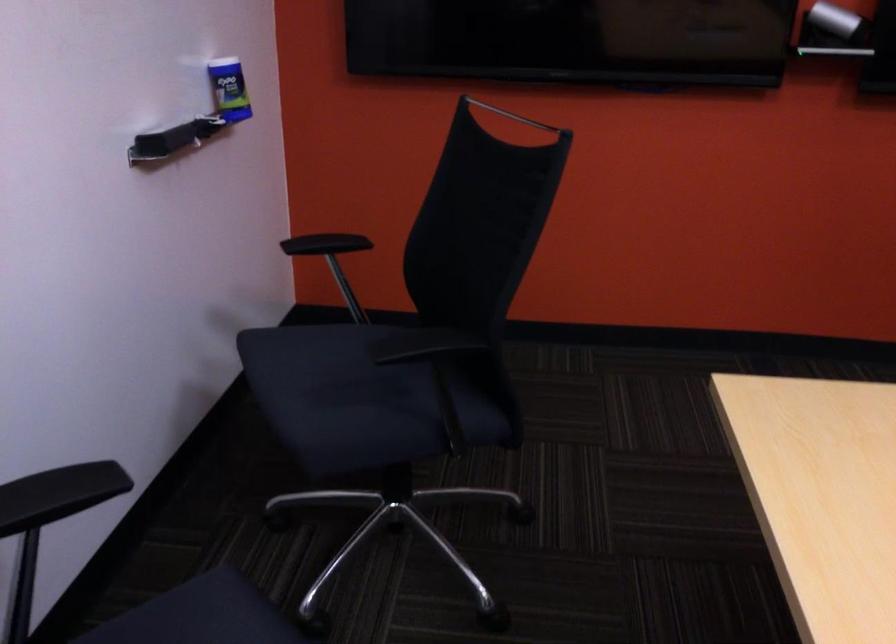
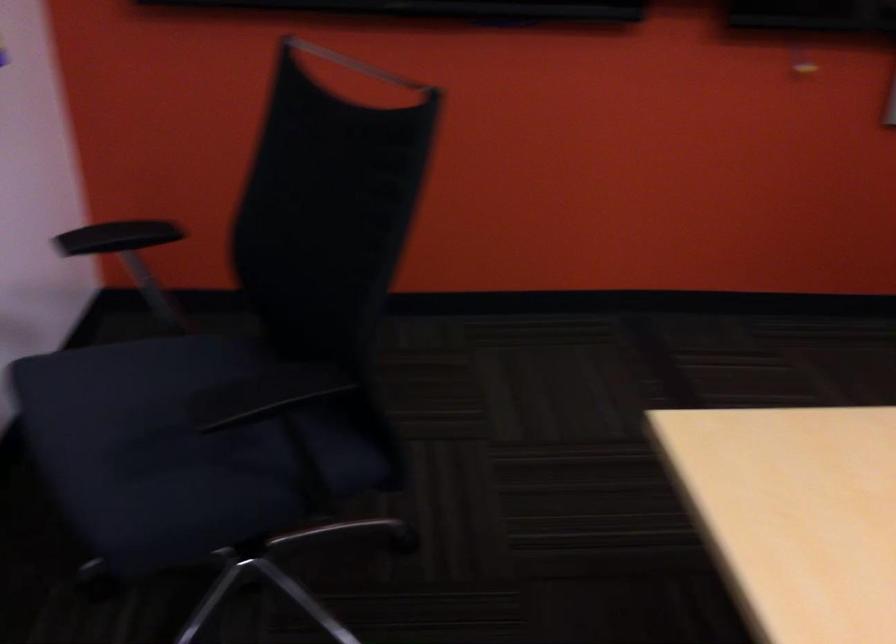
Question: Based on the continuous images, in which direction is the camera rotating? Reply with the corresponding letter.

Choices:
 (A) Left
 (B) Right
 (C) Up
 (D) Down

Answer: (B)